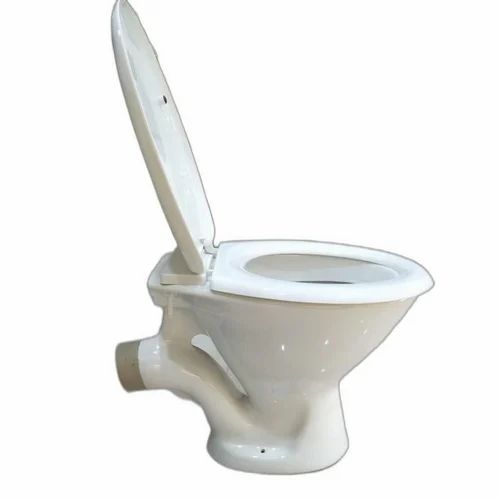
I want to click on base of toilet, so click(x=262, y=472).